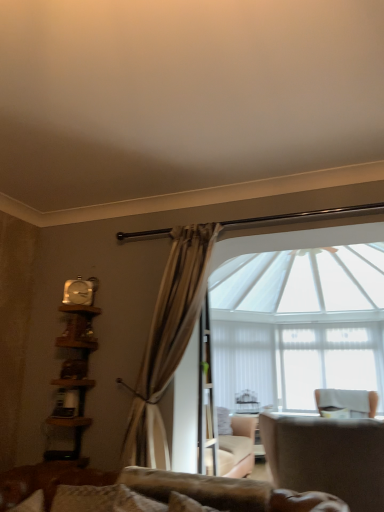
Question: Is leather-like beige armchair at lower right, which appears as the first chair when viewed from the top, shorter than white fabric chair at right, which appears as the first chair when ordered from the bottom?

Choices:
 (A) yes
 (B) no

Answer: (B)

Question: Is leather-like beige armchair at lower right, placed as the second chair when sorted from bottom to top, thinner than white fabric chair at right, positioned as the first chair in back-to-front order?

Choices:
 (A) no
 (B) yes

Answer: (B)

Question: Considering the relative sizes of leather-like beige armchair at lower right, which is the first chair from front to back, and white fabric chair at right, acting as the 2th chair starting from the left, in the image provided, is leather-like beige armchair at lower right, which is the first chair from front to back, smaller than white fabric chair at right, acting as the 2th chair starting from the left,?

Choices:
 (A) no
 (B) yes

Answer: (B)

Question: Is white fabric chair at right, the 1th chair in the right-to-left sequence, located within leather-like beige armchair at lower right, marked as the 2th chair in a right-to-left arrangement?

Choices:
 (A) no
 (B) yes

Answer: (A)

Question: Considering the relative sizes of leather-like beige armchair at lower right, arranged as the first chair when viewed from the left, and white fabric chair at right, the 1th chair in the right-to-left sequence, in the image provided, is leather-like beige armchair at lower right, arranged as the first chair when viewed from the left, wider than white fabric chair at right, the 1th chair in the right-to-left sequence,?

Choices:
 (A) no
 (B) yes

Answer: (A)

Question: Does leather-like beige armchair at lower right, placed as the second chair when sorted from bottom to top, have a larger size compared to white fabric chair at right, positioned as the first chair in back-to-front order?

Choices:
 (A) no
 (B) yes

Answer: (A)

Question: Would you say metallic silver clock at upper left is a long distance from wooden bookshelf at left?

Choices:
 (A) no
 (B) yes

Answer: (A)

Question: From a real-world perspective, is metallic silver clock at upper left located higher than wooden bookshelf at left?

Choices:
 (A) yes
 (B) no

Answer: (A)

Question: Considering the relative positions of metallic silver clock at upper left and wooden bookshelf at left in the image provided, is metallic silver clock at upper left in front of wooden bookshelf at left?

Choices:
 (A) yes
 (B) no

Answer: (B)

Question: Can you confirm if metallic silver clock at upper left is thinner than wooden bookshelf at left?

Choices:
 (A) yes
 (B) no

Answer: (A)

Question: Is metallic silver clock at upper left located outside wooden bookshelf at left?

Choices:
 (A) yes
 (B) no

Answer: (A)

Question: Is metallic silver clock at upper left bigger than wooden bookshelf at left?

Choices:
 (A) yes
 (B) no

Answer: (B)

Question: Does white fabric chair at right, positioned as the first chair in back-to-front order, have a lesser width compared to metallic silver clock at upper left?

Choices:
 (A) no
 (B) yes

Answer: (A)